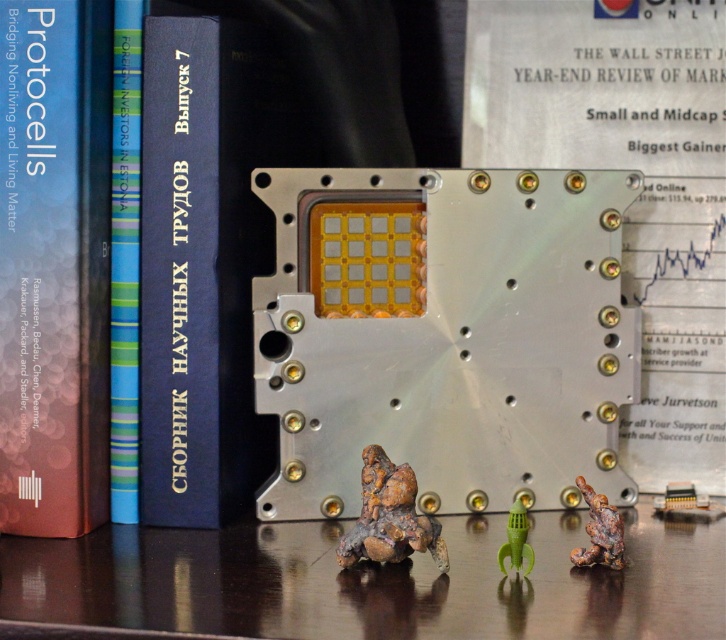
Can you confirm if metallic blue book at left is positioned to the right of rusty metal rock at center?

In fact, metallic blue book at left is to the left of rusty metal rock at center.

Between point (78, 51) and point (380, 476), which one is positioned in front?

Point (380, 476)

This screenshot has width=726, height=640. Describe the element at coordinates (53, 264) in the screenshot. I see `metallic blue book at left` at that location.

I want to click on metallic blue book at left, so click(x=53, y=264).

Who is positioned more to the right, blue striped paper at left or green matte rocket at center?

From the viewer's perspective, green matte rocket at center appears more on the right side.

Does blue striped paper at left have a lesser width compared to green matte rocket at center?

No.

Is point (121, 209) in front of point (521, 538)?

No, (121, 209) is further to viewer.

What are the coordinates of `blue striped paper at left` in the screenshot? It's located at (126, 259).

Can you confirm if metallic blue book at left is positioned above blue striped paper at left?

Incorrect, metallic blue book at left is not positioned above blue striped paper at left.

Which is more to the left, metallic blue book at left or blue striped paper at left?

metallic blue book at left

Describe the element at coordinates (53, 264) in the screenshot. Image resolution: width=726 pixels, height=640 pixels. I see `metallic blue book at left` at that location.

The image size is (726, 640). I want to click on metallic blue book at left, so click(x=53, y=264).